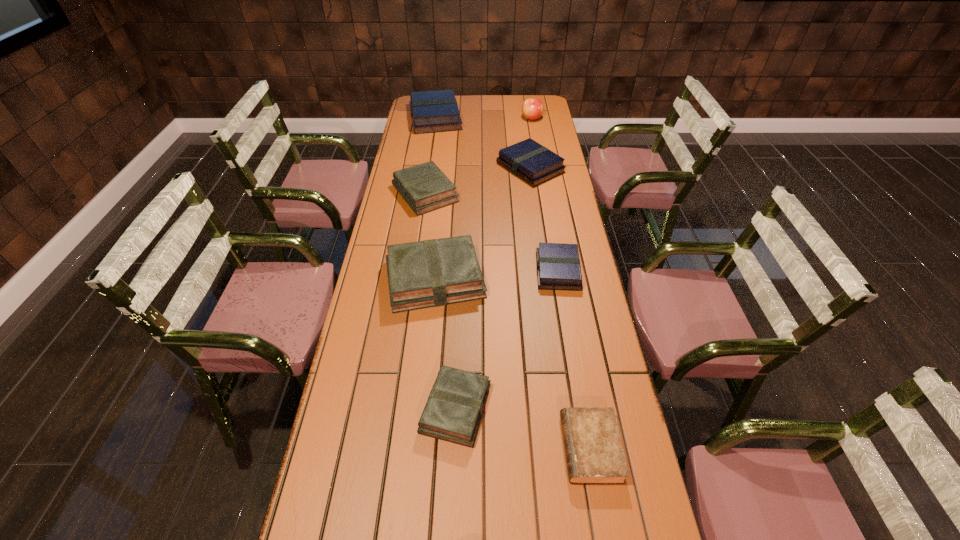
What are the coordinates of `free space between the apple and the second farthest greenish book` in the screenshot? It's located at (484, 199).

At what (x,y) coordinates should I click in order to perform the action: click on vacant space in between the apple and the farthest book. Please return your answer as a coordinate pair (x, y). The height and width of the screenshot is (540, 960). Looking at the image, I should click on 484,118.

Image resolution: width=960 pixels, height=540 pixels. In order to click on empty location between the diary and the nearest blue book in this screenshot , I will do `click(574, 360)`.

Identify the location of vacant area that lies between the farthest greenish book and the second farthest greenish book. (430, 236).

The image size is (960, 540). Find the location of `free point between the tallest object and the farthest book`. free point between the tallest object and the farthest book is located at coordinates (484, 118).

Where is `empty location between the farthest greenish book and the nearest blue book`? empty location between the farthest greenish book and the nearest blue book is located at coordinates (492, 232).

Identify the location of object that is the sixth closest one to the farthest book. The width and height of the screenshot is (960, 540). (455, 405).

Find the location of a particular element. object that stands as the second closest to the second biggest greenish book is located at coordinates (436, 272).

Image resolution: width=960 pixels, height=540 pixels. What are the coordinates of `book that is the fourth closest one to the second smallest blue book` in the screenshot? It's located at (558, 267).

You are a GUI agent. You are given a task and a screenshot of the screen. Output one action in this format:
    pyautogui.click(x=<x>, y=<y>)
    Task: Click on the fifth closest book relative to the biggest greenish book
    The width and height of the screenshot is (960, 540).
    Given the screenshot: What is the action you would take?
    pyautogui.click(x=431, y=111)